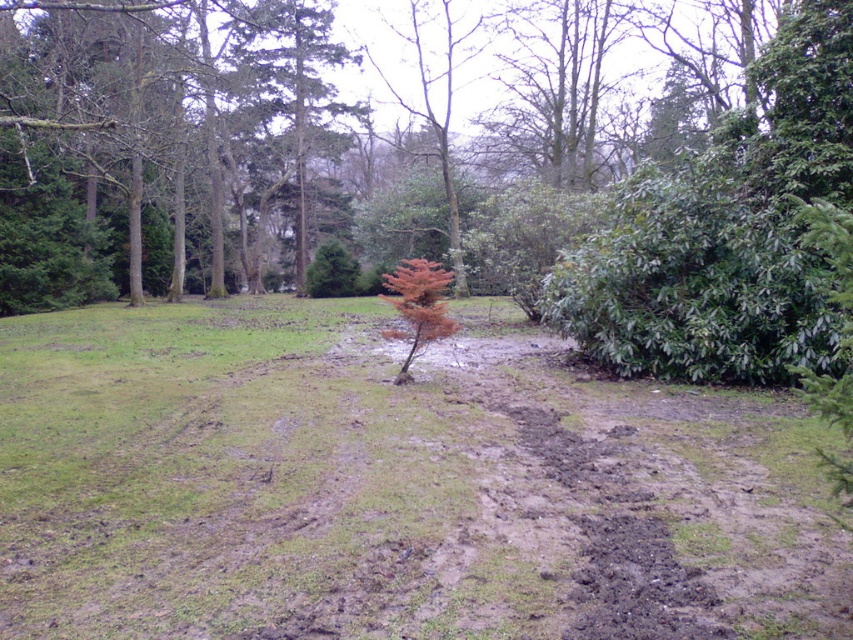
Question: Does green grass at center have a lesser width compared to brown textured tree at upper center?

Choices:
 (A) no
 (B) yes

Answer: (A)

Question: Does green grass at center appear under brown textured tree at upper center?

Choices:
 (A) yes
 (B) no

Answer: (A)

Question: Among these points, which one is farthest from the camera?

Choices:
 (A) (251, 154)
 (B) (49, 486)

Answer: (A)

Question: Observing the image, what is the correct spatial positioning of green grass at center in reference to brown textured tree at upper center?

Choices:
 (A) right
 (B) left

Answer: (A)